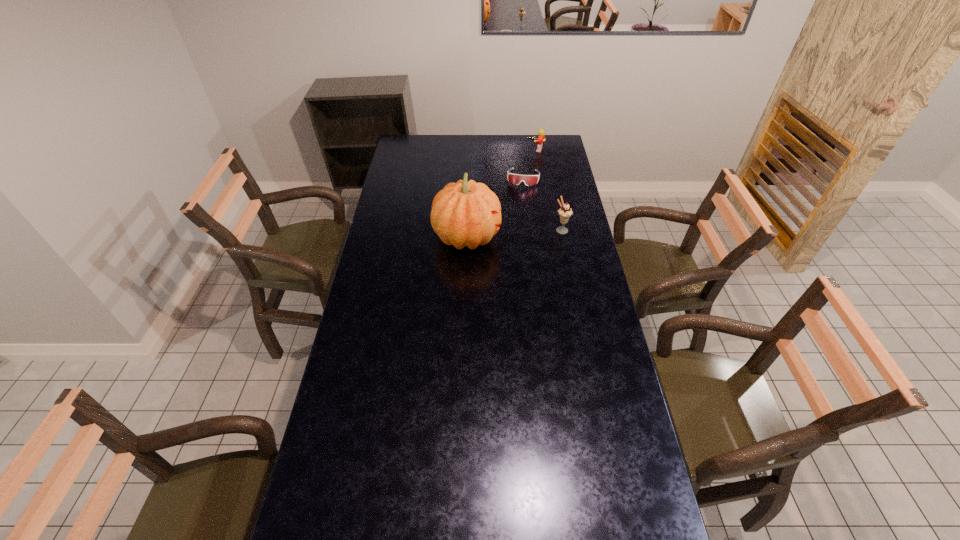
At what (x,y) coordinates should I click in order to perform the action: click on free spot on the desktop that is between the tallest object and the third shortest object and is positioned in front of the third tallest object with the accessory visible. Please return your answer as a coordinate pair (x, y). Looking at the image, I should click on (501, 234).

Where is `vacant spot on the desktop that is between the tallest object and the third shortest object and is positioned on the front-facing side of the goggles`? The height and width of the screenshot is (540, 960). vacant spot on the desktop that is between the tallest object and the third shortest object and is positioned on the front-facing side of the goggles is located at coordinates (516, 233).